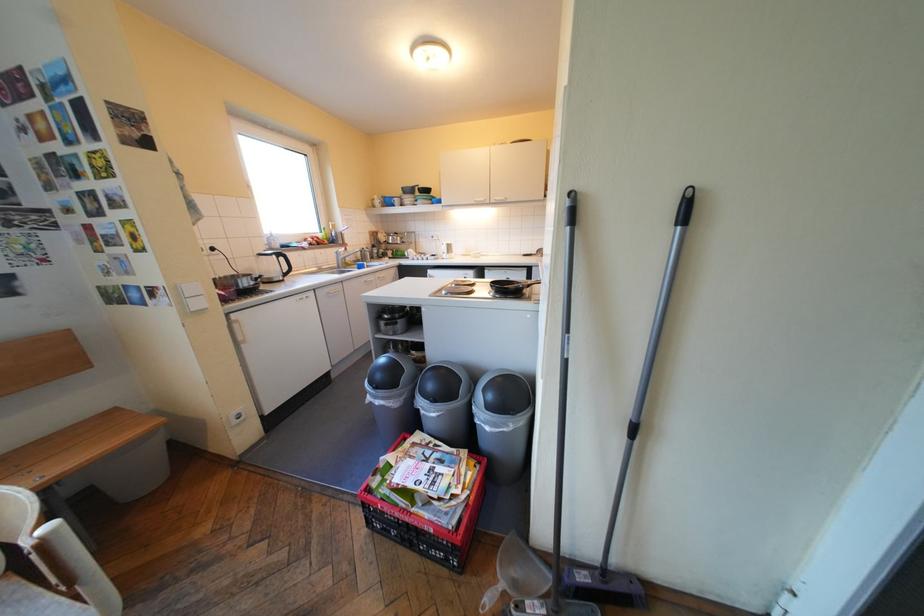
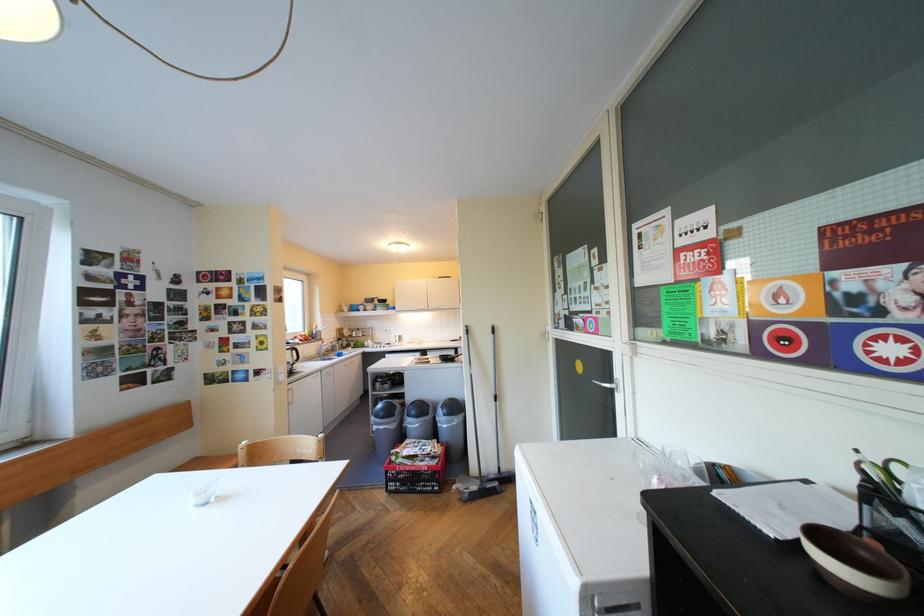
In the second image, find the point that corresponds to point (403, 378) in the first image.

(402, 411)